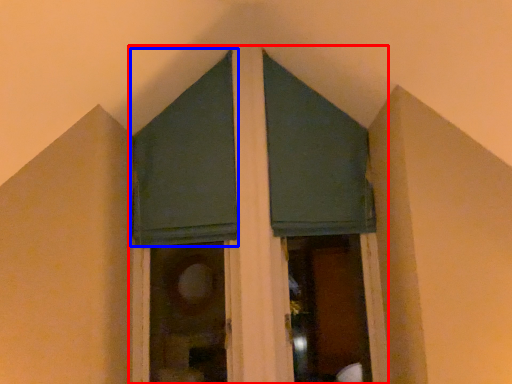
Question: Which of the following is the farthest to the observer, bay window (highlighted by a red box) or window screen (highlighted by a blue box)?

Choices:
 (A) bay window
 (B) window screen

Answer: (B)